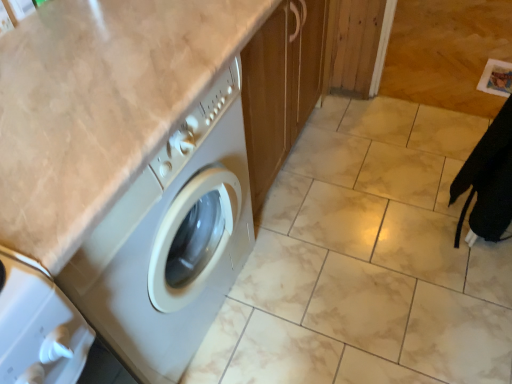
The height and width of the screenshot is (384, 512). Describe the element at coordinates (447, 52) in the screenshot. I see `marble tile at lower right` at that location.

Identify the location of marble tile at lower right. (447, 52).

Locate an element on the screen. The width and height of the screenshot is (512, 384). beige marble counter top at upper left is located at coordinates 100,105.

What do you see at coordinates (100, 105) in the screenshot?
I see `beige marble counter top at upper left` at bounding box center [100, 105].

In order to face beige marble counter top at upper left, should I rotate leftwards or rightwards?

You should rotate left by 18.677 degrees.

You are a GUI agent. You are given a task and a screenshot of the screen. Output one action in this format:
    pyautogui.click(x=<x>, y=<y>)
    Task: Click on the marble tile at lower right
    
    Given the screenshot: What is the action you would take?
    pyautogui.click(x=447, y=52)

Which is more to the right, marble tile at lower right or beige marble counter top at upper left?

marble tile at lower right is more to the right.

Is marble tile at lower right positioned in front of beige marble counter top at upper left?

No, marble tile at lower right is behind beige marble counter top at upper left.

Considering the points (449, 48) and (126, 45), which point is behind, point (449, 48) or point (126, 45)?

The point (449, 48) is more distant.

From the image's perspective, is marble tile at lower right under beige marble counter top at upper left?

No, from the image's perspective, marble tile at lower right is not below beige marble counter top at upper left.

From a real-world perspective, is marble tile at lower right above or below beige marble counter top at upper left?

In terms of real-world spatial position, marble tile at lower right is below beige marble counter top at upper left.

Between marble tile at lower right and beige marble counter top at upper left, which one has larger width?

marble tile at lower right is wider.

Considering the sizes of objects marble tile at lower right and beige marble counter top at upper left in the image provided, who is taller, marble tile at lower right or beige marble counter top at upper left?

With more height is beige marble counter top at upper left.

Which of these two, marble tile at lower right or beige marble counter top at upper left, is smaller?

With smaller size is marble tile at lower right.

Which is correct: marble tile at lower right is inside beige marble counter top at upper left, or outside of it?

marble tile at lower right is located beyond the bounds of beige marble counter top at upper left.

Is marble tile at lower right directly adjacent to beige marble counter top at upper left?

No.

Is marble tile at lower right facing towards beige marble counter top at upper left?

No, marble tile at lower right is not facing towards beige marble counter top at upper left.

Can you tell me how much marble tile at lower right and beige marble counter top at upper left differ in facing direction?

They differ by 89 degrees in their facing directions.

I want to click on granite behind the beige marble counter top at upper left, so click(x=447, y=52).

Is beige marble counter top at upper left at the left side of marble tile at lower right?

Correct, you'll find beige marble counter top at upper left to the left of marble tile at lower right.

Between beige marble counter top at upper left and marble tile at lower right, which one is positioned in front?

beige marble counter top at upper left is closer to the camera.

Between point (53, 111) and point (509, 56), which one is positioned in front?

The point (53, 111) is closer to the camera.

From the image's perspective, which object appears higher, beige marble counter top at upper left or marble tile at lower right?

marble tile at lower right.

From a real-world perspective, is beige marble counter top at upper left beneath marble tile at lower right?

Actually, beige marble counter top at upper left is physically above marble tile at lower right in the real world.

Between beige marble counter top at upper left and marble tile at lower right, which one has smaller width?

Thinner between the two is beige marble counter top at upper left.

Does beige marble counter top at upper left have a lesser height compared to marble tile at lower right?

No.

Can you confirm if beige marble counter top at upper left is smaller than marble tile at lower right?

No, beige marble counter top at upper left is not smaller than marble tile at lower right.

Which is correct: beige marble counter top at upper left is inside marble tile at lower right, or outside of it?

beige marble counter top at upper left is spatially situated outside marble tile at lower right.

Is beige marble counter top at upper left positioned far away from marble tile at lower right?

Yes, beige marble counter top at upper left and marble tile at lower right are located far from each other.

Is beige marble counter top at upper left aimed at marble tile at lower right?

No, beige marble counter top at upper left is not aimed at marble tile at lower right.

Consider the image. How many degrees apart are the facing directions of beige marble counter top at upper left and marble tile at lower right?

There is a 89-degree angle between the facing directions of beige marble counter top at upper left and marble tile at lower right.

You are a GUI agent. You are given a task and a screenshot of the screen. Output one action in this format:
    pyautogui.click(x=<x>, y=<y>)
    Task: Click on the granite above the beige marble counter top at upper left (from the image's perspective)
    
    Given the screenshot: What is the action you would take?
    pyautogui.click(x=447, y=52)

Identify the location of counter top above the marble tile at lower right (from a real-world perspective). The height and width of the screenshot is (384, 512). (100, 105).

Find the location of `granite lying on the right of beige marble counter top at upper left`. granite lying on the right of beige marble counter top at upper left is located at coordinates (447, 52).